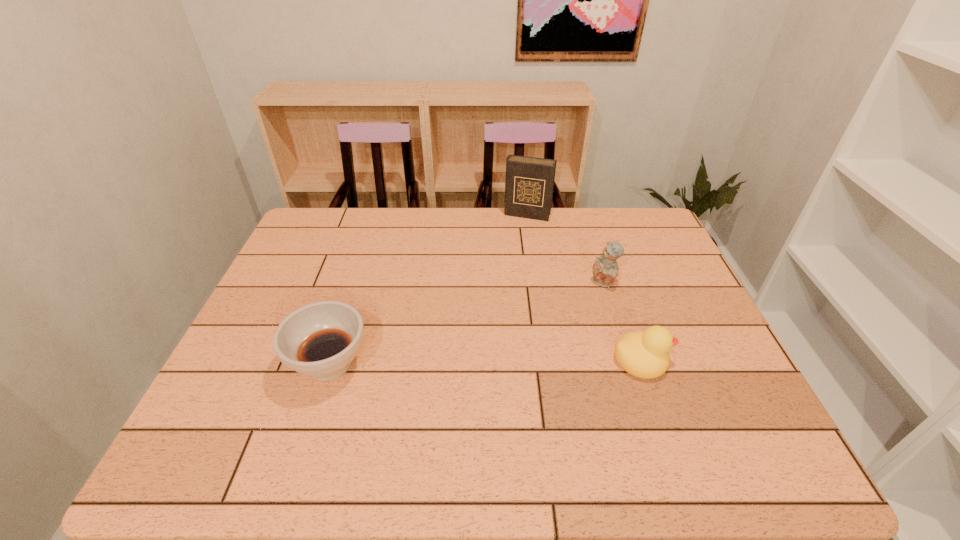
The height and width of the screenshot is (540, 960). I want to click on free space at the near edge of the desktop, so click(608, 413).

Identify the location of vacant region at the right edge of the desktop. The height and width of the screenshot is (540, 960). (688, 370).

Find the location of a particular element. This screenshot has width=960, height=540. vacant space at the far left corner of the desktop is located at coordinates (354, 211).

This screenshot has width=960, height=540. I want to click on free space at the far right corner of the desktop, so click(x=650, y=218).

Find the location of a particular element. This screenshot has height=540, width=960. vacant space in between the soup bowl and the farthest object is located at coordinates (428, 289).

In order to click on free space between the soup bowl and the tallest object in this screenshot , I will do `click(428, 289)`.

What are the coordinates of `free space between the leftmost object and the duckling` in the screenshot? It's located at (486, 361).

Identify the location of free space between the duckling and the teddy bear. This screenshot has height=540, width=960. (622, 321).

This screenshot has width=960, height=540. What are the coordinates of `unoccupied area between the duckling and the soup bowl` in the screenshot? It's located at (486, 361).

You are a GUI agent. You are given a task and a screenshot of the screen. Output one action in this format:
    pyautogui.click(x=<x>, y=<y>)
    Task: Click on the empty space between the third nearest object and the duckling
    The width and height of the screenshot is (960, 540).
    Given the screenshot: What is the action you would take?
    pyautogui.click(x=622, y=321)